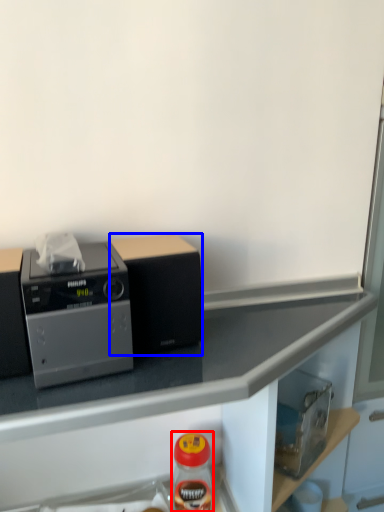
Question: Among these objects, which one is farthest to the camera, bottle (highlighted by a red box) or appliance (highlighted by a blue box)?

Choices:
 (A) bottle
 (B) appliance

Answer: (A)